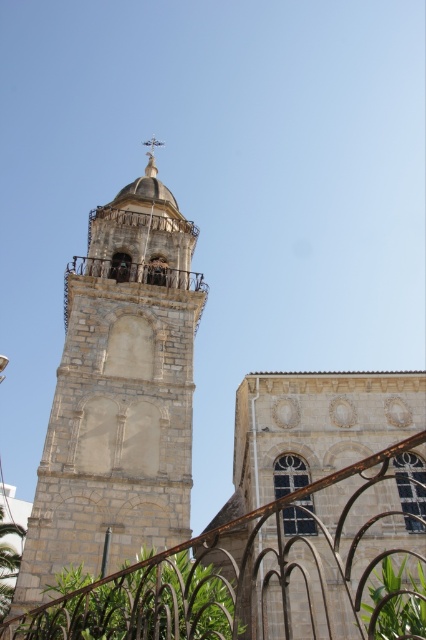
You are standing in front of the historic stone church and want to determine the relative positions of two points on the bell tower. The first point is located at coordinates point (167, 538) and the second at point (394, 621). Which point is closer to you?

Point (167, 538) is closer to you because it is further to the viewer than point (394, 621).

You are standing at the entrance of the historic stone church and want to reach the white stone spire at upper center. There is a rusty metal fence at lower left blocking your path. Can you walk around the fence to reach the spire?

The rusty metal fence at lower left is 71.95 meters away from the white stone spire at upper center. Since the fence is blocking your path but located at a distance, you can walk around it to reach the spire.